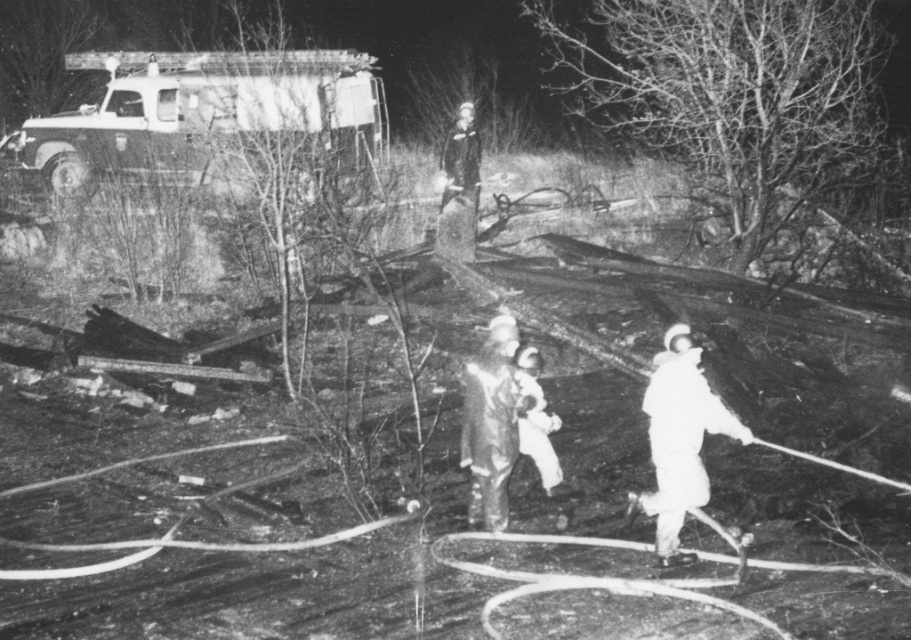
Between point (799, 116) and point (451, 180), which one is positioned behind?

The point (451, 180) is behind.

Is point (651, 138) in front of point (447, 212)?

No, (651, 138) is further to viewer.

Between point (875, 22) and point (469, 253), which one is positioned in front?

Positioned in front is point (469, 253).

Where is `bare branches at upper right`? The height and width of the screenshot is (640, 911). bare branches at upper right is located at coordinates (732, 97).

Does white matte hazmat suit at right have a greater width compared to bare branches at upper left?

No.

Is white matte hazmat suit at right below bare branches at upper left?

Indeed, white matte hazmat suit at right is positioned under bare branches at upper left.

Measure the distance between point (x=659, y=525) and camera.

A distance of 6.74 meters exists between point (x=659, y=525) and camera.

Image resolution: width=911 pixels, height=640 pixels. What are the coordinates of `white matte hazmat suit at right` in the screenshot? It's located at (679, 440).

Which is below, rubberized white suit at center or dark gray uniform at center?

rubberized white suit at center

Can you confirm if rubberized white suit at center is positioned to the right of dark gray uniform at center?

Correct, you'll find rubberized white suit at center to the right of dark gray uniform at center.

Does point (487, 426) come farther from viewer compared to point (464, 164)?

No, (487, 426) is closer to viewer.

You are a GUI agent. You are given a task and a screenshot of the screen. Output one action in this format:
    pyautogui.click(x=<x>, y=<y>)
    Task: Click on the rubberized white suit at center
    
    Given the screenshot: What is the action you would take?
    (490, 424)